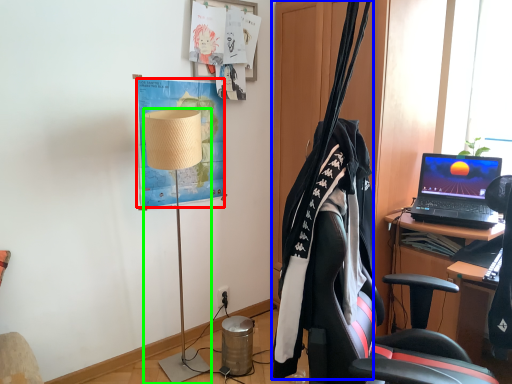
Question: Which is nearer to the poster (highlighted by a red box)? clothesline (highlighted by a blue box) or lamp (highlighted by a green box).

Choices:
 (A) clothesline
 (B) lamp

Answer: (B)